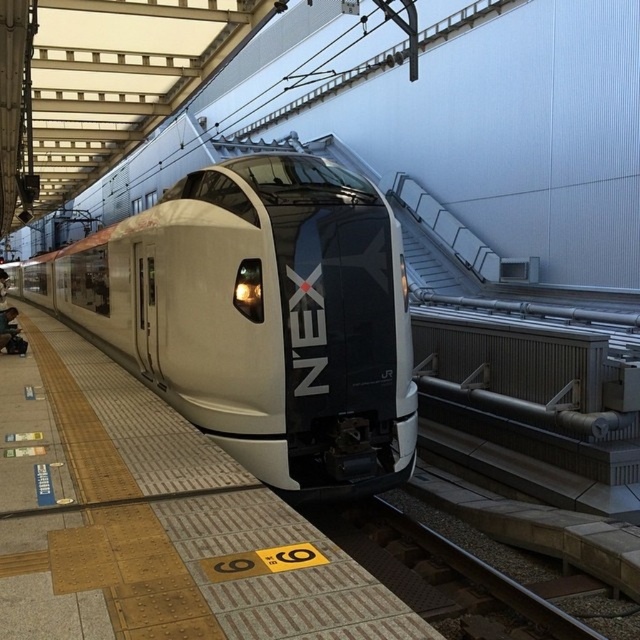
Is sleek metallic train at center positioned at the back of smooth beige platform at center?

That is True.

Looking at this image, who is more distant from viewer, (67, 252) or (321, 544)?

Point (67, 252)

Where is `sleek metallic train at center`? The height and width of the screenshot is (640, 640). sleek metallic train at center is located at coordinates (259, 317).

Can you confirm if smooth beige platform at center is thinner than smooth metal train track at center?

No.

Looking at this image, who is more forward, (397, 614) or (362, 536)?

Point (397, 614) is in front.

Locate an element on the screen. The width and height of the screenshot is (640, 640). smooth beige platform at center is located at coordinates (154, 522).

Consider the image. Who is positioned more to the left, sleek metallic train at center or smooth metal train track at center?

sleek metallic train at center is more to the left.

Does point (88, 317) come in front of point (438, 588)?

That is False.

Measure the distance between sleek metallic train at center and camera.

sleek metallic train at center and camera are 5.75 meters apart from each other.

I want to click on sleek metallic train at center, so 259,317.